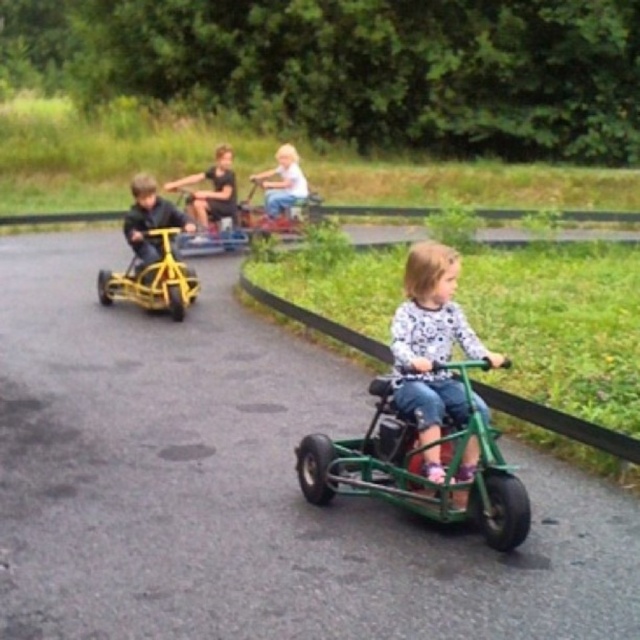
Who is more distant from viewer, (468, 508) or (424, 252)?

Point (424, 252)

Between green matte tricycle at center and patterned fabric shirt at center, which one is positioned lower?

Positioned lower is green matte tricycle at center.

Which is in front, point (353, 456) or point (424, 253)?

Point (424, 253) is more forward.

This screenshot has width=640, height=640. I want to click on green matte tricycle at center, so click(417, 472).

Which is in front, point (189, 292) or point (298, 202)?

Point (189, 292) is in front.

Which is more to the right, yellow matte toy car at left or white matte shirt at center?

From the viewer's perspective, white matte shirt at center appears more on the right side.

You are a GUI agent. You are given a task and a screenshot of the screen. Output one action in this format:
    pyautogui.click(x=<x>, y=<y>)
    Task: Click on the yellow matte toy car at left
    This screenshot has width=640, height=640.
    Given the screenshot: What is the action you would take?
    pyautogui.click(x=152, y=280)

Between point (403, 342) and point (125, 280), which one is positioned behind?

Positioned behind is point (125, 280).

Does patterned fabric shirt at center appear under yellow matte toy car at left?

Correct, patterned fabric shirt at center is located below yellow matte toy car at left.

Which is in front, point (424, 324) or point (150, 230)?

Point (424, 324)

Identify the location of patterned fabric shirt at center. This screenshot has width=640, height=640. (432, 340).